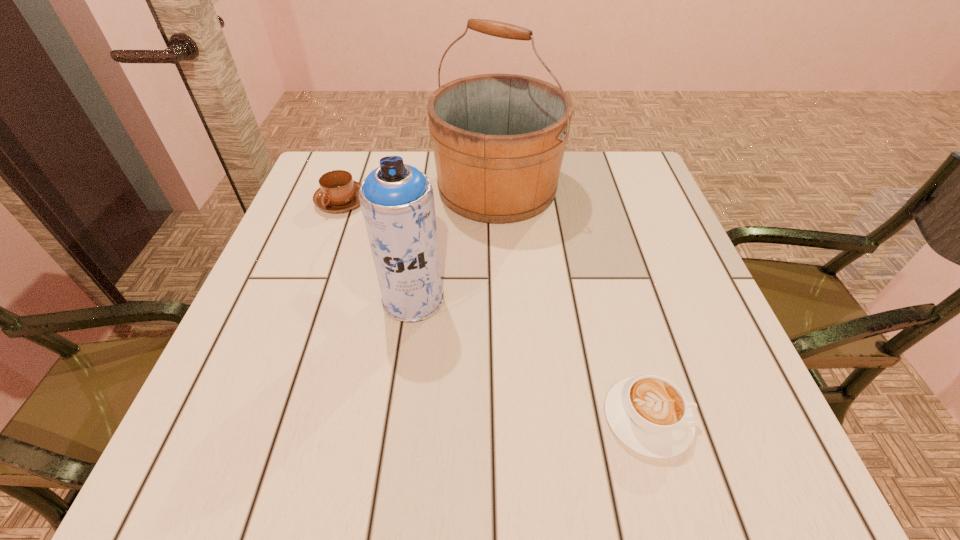
Locate an element on the screen. This screenshot has height=540, width=960. vacant space located on the side of the nearer cappuccino with the handle is located at coordinates (741, 418).

You are a GUI agent. You are given a task and a screenshot of the screen. Output one action in this format:
    pyautogui.click(x=<x>, y=<y>)
    Task: Click on the bucket at the far edge
    
    Given the screenshot: What is the action you would take?
    pyautogui.click(x=498, y=139)

This screenshot has width=960, height=540. I want to click on cappuccino present at the far edge, so click(x=338, y=192).

The width and height of the screenshot is (960, 540). I want to click on object that is at the near edge, so click(649, 414).

Image resolution: width=960 pixels, height=540 pixels. I want to click on object that is at the left edge, so click(x=338, y=192).

Where is `object located at the right edge`? The width and height of the screenshot is (960, 540). object located at the right edge is located at coordinates (649, 414).

Where is `object situated at the far left corner`? object situated at the far left corner is located at coordinates (338, 192).

Identify the location of object located at the near right corner. Image resolution: width=960 pixels, height=540 pixels. [x=649, y=414].

Where is `free space at the near edge`? The width and height of the screenshot is (960, 540). free space at the near edge is located at coordinates (628, 448).

Find the location of a particular element. The height and width of the screenshot is (540, 960). free point at the left edge is located at coordinates (224, 382).